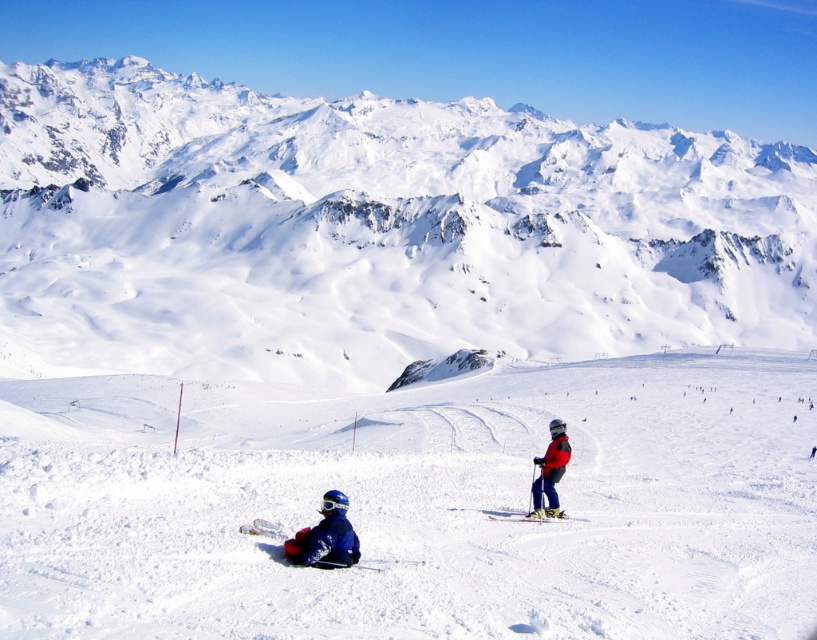
Question: Which of the following is the closest to the observer?

Choices:
 (A) white snow-covered mountain range at upper center
 (B) shiny metallic ski at lower right
 (C) blue fleece jacket at lower center

Answer: (C)

Question: Which is nearer to the white snow-covered mountain range at upper center?

Choices:
 (A) blue fleece jacket at lower center
 (B) shiny metallic ski at lower right
 (C) white snow ski slope at center

Answer: (C)

Question: Is white snow-covered mountain range at upper center below red ski suit at center?

Choices:
 (A) yes
 (B) no

Answer: (B)

Question: Is white snow-covered mountain range at upper center to the left of shiny metallic ski at lower right from the viewer's perspective?

Choices:
 (A) no
 (B) yes

Answer: (A)

Question: Which of these objects is positioned farthest from the white snow ski slope at center?

Choices:
 (A) shiny metallic ski at lower right
 (B) red ski suit at center
 (C) blue fleece jacket at lower center

Answer: (A)

Question: Can you confirm if white snow ski slope at center is positioned to the left of shiny metallic ski at lower right?

Choices:
 (A) yes
 (B) no

Answer: (B)